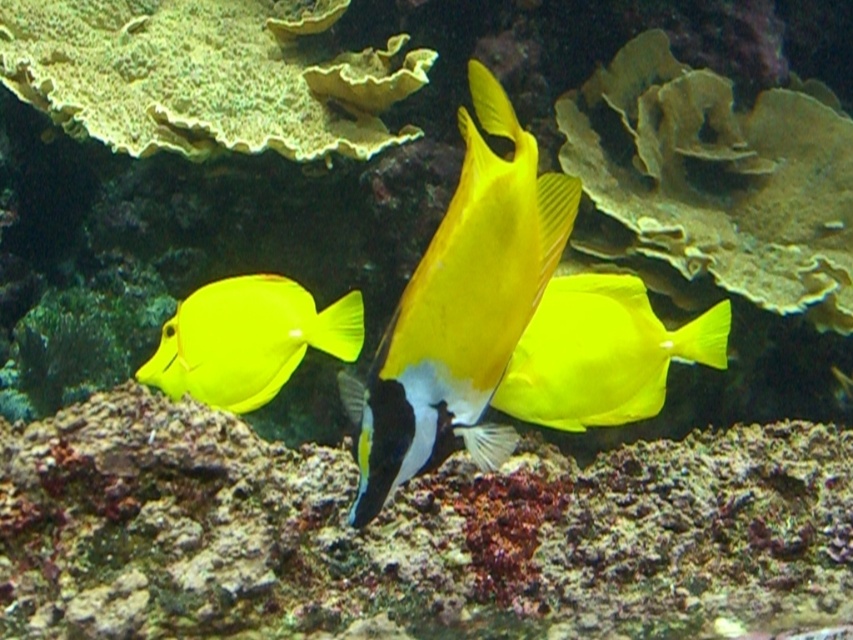
You are a marine biologist observing the underwater scene. You need to determine if the two yellow fish can be safely netted in one catch. The net you have has a maximum reach of 65 centimeters. Can you capture both the yellow matte fish at center and the matte yellow fish at left with a single net? Explain your reasoning.

The yellow matte fish at center and the matte yellow fish at left are 64.28 centimeters apart. Since the net has a maximum reach of 65 centimeters, which is slightly longer than the distance between them, you can safely capture both fish in one net.

You are an underwater photographer aiming to capture the largest matte yellow fish in the scene. Given that you see both the matte yellow fish at center and the matte yellow fish at left, which one should you focus on to ensure you photograph the taller fish?

The matte yellow fish at center has a greater height compared to the matte yellow fish at left, so you should focus on the matte yellow fish at center to photograph the taller fish.